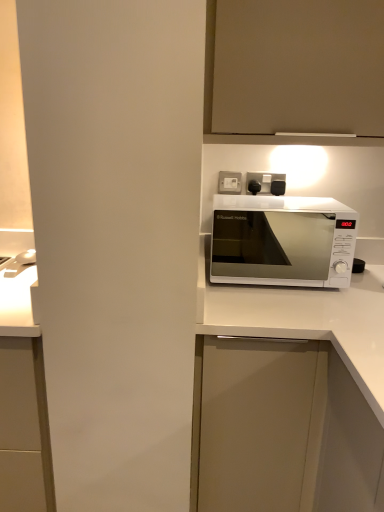
Question: Is white matte cabinet at center, which is the 1th cabinetry in bottom-to-top order, taller than white plastic socket at upper center?

Choices:
 (A) yes
 (B) no

Answer: (A)

Question: Is white matte cabinet at center, which appears as the 2th cabinetry when viewed from the top, bigger than white plastic socket at upper center?

Choices:
 (A) yes
 (B) no

Answer: (A)

Question: From the image's perspective, is white matte cabinet at center, which is the 1th cabinetry in bottom-to-top order, located above white plastic socket at upper center?

Choices:
 (A) no
 (B) yes

Answer: (A)

Question: Is white matte cabinet at center, which appears as the 2th cabinetry when viewed from the top, wider than white plastic socket at upper center?

Choices:
 (A) no
 (B) yes

Answer: (B)

Question: Would you consider white matte cabinet at center, which is the 1th cabinetry in bottom-to-top order, to be distant from white plastic socket at upper center?

Choices:
 (A) yes
 (B) no

Answer: (B)

Question: From a real-world perspective, is white glossy microwave at center physically located above or below white plastic socket at upper center?

Choices:
 (A) above
 (B) below

Answer: (B)

Question: In terms of height, does white glossy microwave at center look taller or shorter compared to white plastic socket at upper center?

Choices:
 (A) tall
 (B) short

Answer: (A)

Question: Is white glossy microwave at center in front of or behind white plastic socket at upper center in the image?

Choices:
 (A) behind
 (B) front

Answer: (B)

Question: Considering the positions of white glossy microwave at center and white plastic socket at upper center in the image, is white glossy microwave at center bigger or smaller than white plastic socket at upper center?

Choices:
 (A) big
 (B) small

Answer: (A)

Question: Considering their positions, is white plastic socket at upper center located in front of or behind matte white cabinet at upper center, which is counted as the 2th cabinetry, starting from the bottom?

Choices:
 (A) behind
 (B) front

Answer: (A)

Question: From a real-world perspective, is white plastic socket at upper center above or below matte white cabinet at upper center, which is counted as the 2th cabinetry, starting from the bottom?

Choices:
 (A) above
 (B) below

Answer: (B)

Question: Is white plastic socket at upper center situated inside matte white cabinet at upper center, which is counted as the 2th cabinetry, starting from the bottom, or outside?

Choices:
 (A) inside
 (B) outside

Answer: (B)

Question: Considering the positions of point (240, 177) and point (322, 29), is point (240, 177) closer or farther from the camera than point (322, 29)?

Choices:
 (A) farther
 (B) closer

Answer: (A)

Question: From a real-world perspective, is matte white cabinet at upper center, arranged as the first cabinetry when viewed from the top, above or below white glossy microwave at center?

Choices:
 (A) above
 (B) below

Answer: (A)

Question: Is matte white cabinet at upper center, which is counted as the 2th cabinetry, starting from the bottom, to the left or to the right of white glossy microwave at center in the image?

Choices:
 (A) right
 (B) left

Answer: (A)